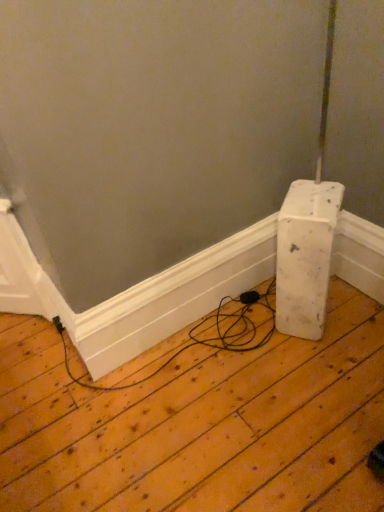
Image resolution: width=384 pixels, height=512 pixels. What are the coordinates of `black plastic outlet at lower left` in the screenshot? It's located at (58, 324).

Describe the element at coordinates (58, 324) in the screenshot. I see `black plastic outlet at lower left` at that location.

Where is `black plastic outlet at lower left`? black plastic outlet at lower left is located at coordinates click(58, 324).